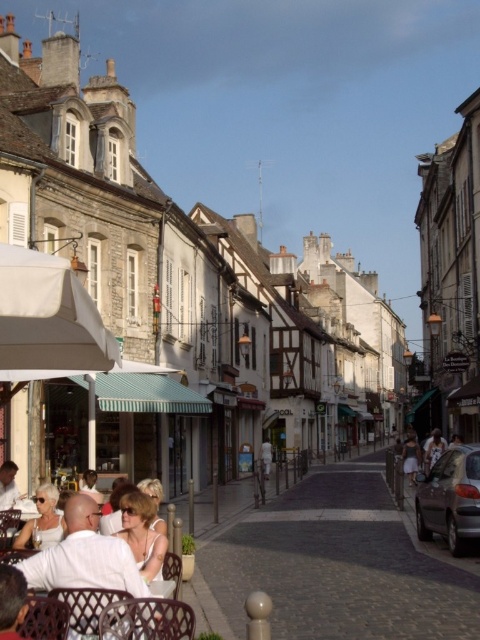
You are standing on the cobblestone street in the European town scene. You see a point marked at coordinates (84,556). What object does this point correspond to?

The point at coordinates (84,556) corresponds to the white fabric dress at lower left.

You are a tourist walking along the cobblestone street in the European town and see a white fabric dress at lower left and a dark gray fabric dress at center. Which dress is closer to you?

The white fabric dress at lower left is closer to you since it is in front of the dark gray fabric dress at center.